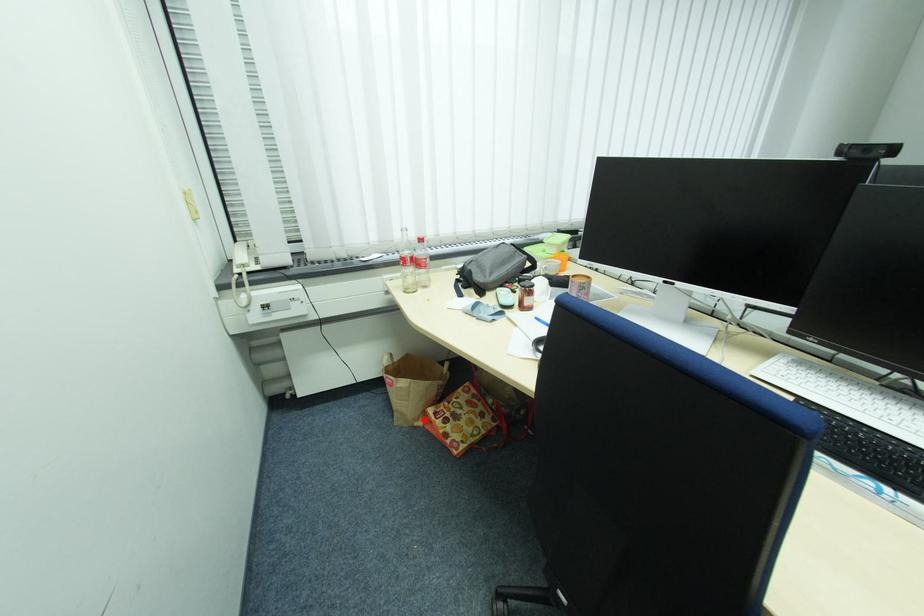
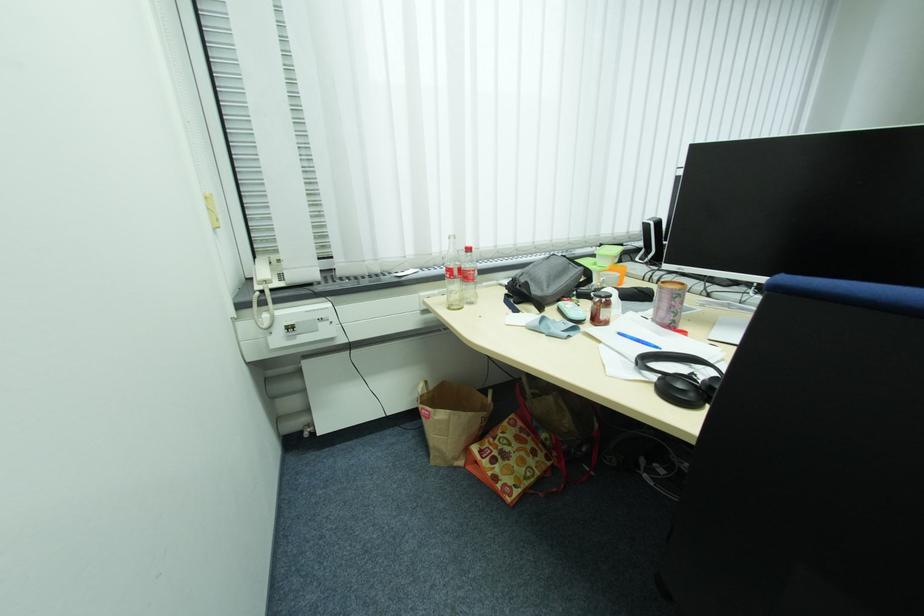
Locate, in the second image, the point that corresponds to the highlighted location in the first image.

(464, 460)